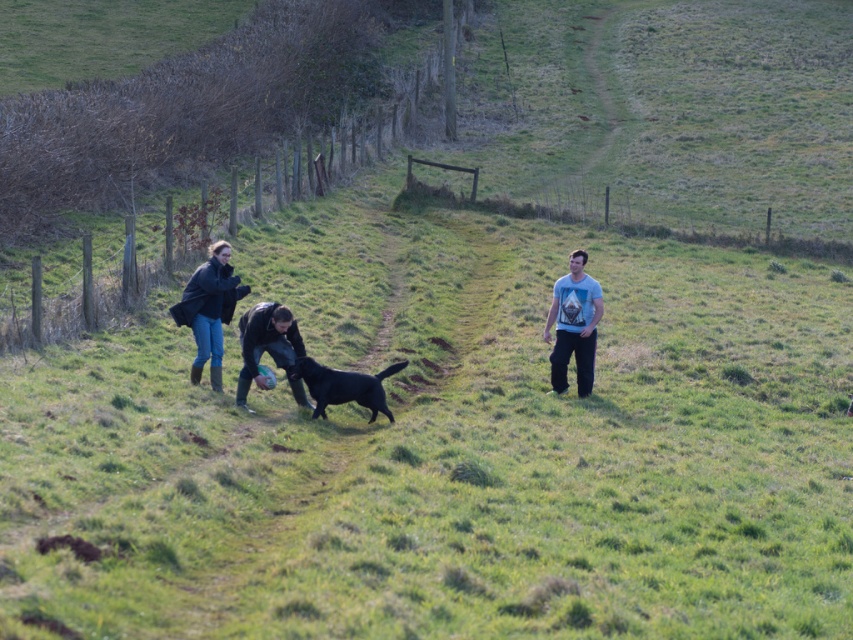
Question: Which point is farther to the camera?

Choices:
 (A) (204, 266)
 (B) (387, 412)
 (C) (285, 337)

Answer: (A)

Question: In this image, where is dark blue leather jacket at left located relative to matte black jacket at center?

Choices:
 (A) below
 (B) above

Answer: (B)

Question: Is dark blue leather jacket at left to the right of matte black jacket at center from the viewer's perspective?

Choices:
 (A) yes
 (B) no

Answer: (B)

Question: Among these points, which one is farthest from the camera?

Choices:
 (A) (386, 368)
 (B) (302, 349)
 (C) (204, 326)
 (D) (555, 282)

Answer: (D)

Question: Which point appears closest to the camera in this image?

Choices:
 (A) tap(322, 392)
 (B) tap(252, 358)
 (C) tap(592, 323)
 (D) tap(216, 269)

Answer: (B)

Question: Is dark blue leather jacket at left bigger than black glossy dog at center?

Choices:
 (A) no
 (B) yes

Answer: (B)